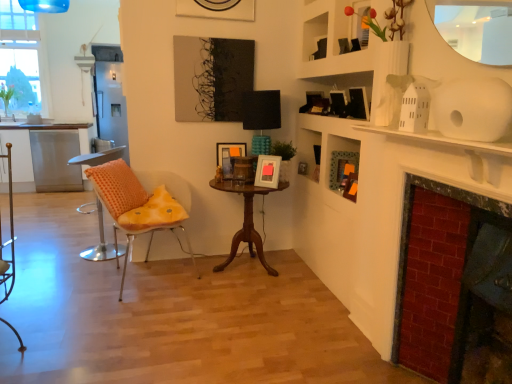
Question: From the image's perspective, is transparent glass window at upper left positioned above or below mahogany wood table at center?

Choices:
 (A) below
 (B) above

Answer: (B)

Question: Is transparent glass window at upper left wider or thinner than mahogany wood table at center?

Choices:
 (A) thin
 (B) wide

Answer: (A)

Question: Estimate the real-world distances between objects in this image. Which object is farther from the orange dotted fabric chair at left, arranged as the 2th chair when viewed from the right?

Choices:
 (A) transparent glass window at upper left
 (B) red brick fireplace at right
 (C) mahogany wood table at center
 (D) matte green frame at upper right
 (E) wooden picture frame at center, acting as the 1th picture frame starting from the right

Answer: (A)

Question: Which object is the farthest from the matte green frame at upper right?

Choices:
 (A) orange fabric chair at left, the 2th chair positioned from the left
 (B) mahogany wood table at center
 (C) matte wooden picture frame at center, the 1th picture frame positioned from the back
 (D) orange dotted pillow at left
 (E) wooden picture frame at center, positioned as the 2th picture frame in back-to-front order

Answer: (D)